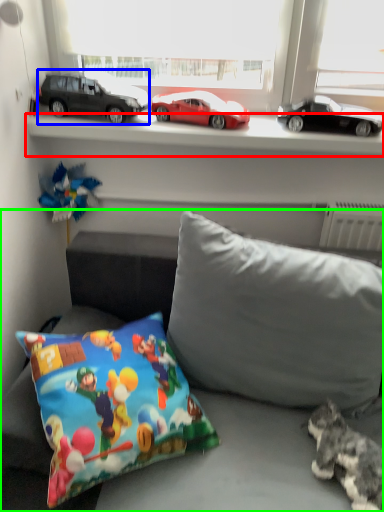
Question: Which object is the closest to the window sill (highlighted by a red box)? Choose among these: car (highlighted by a blue box) or studio couch (highlighted by a green box).

Choices:
 (A) car
 (B) studio couch

Answer: (A)